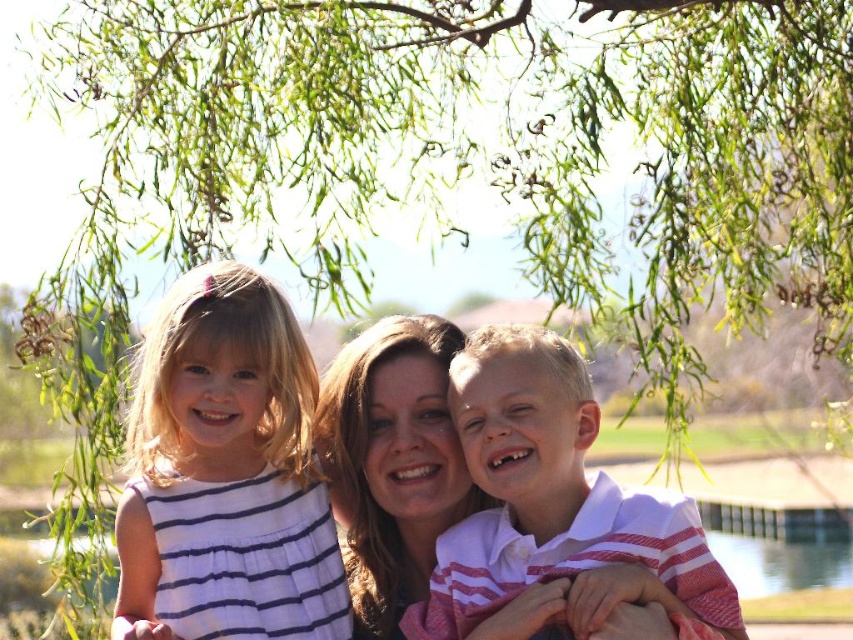
Does white striped dress at left have a smaller size compared to white striped shirt at center?

No, white striped dress at left is not smaller than white striped shirt at center.

In the scene shown: Which is above, white striped dress at left or white striped shirt at center?

white striped dress at left is higher up.

Describe the element at coordinates (225, 474) in the screenshot. I see `white striped dress at left` at that location.

The image size is (853, 640). In order to click on white striped dress at left in this screenshot , I will do `click(225, 474)`.